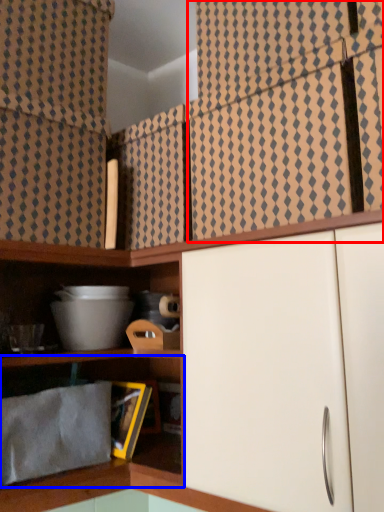
Question: Which point is closer to the camera, curtain (highlighted by a red box) or shelf (highlighted by a blue box)?

Choices:
 (A) curtain
 (B) shelf

Answer: (A)